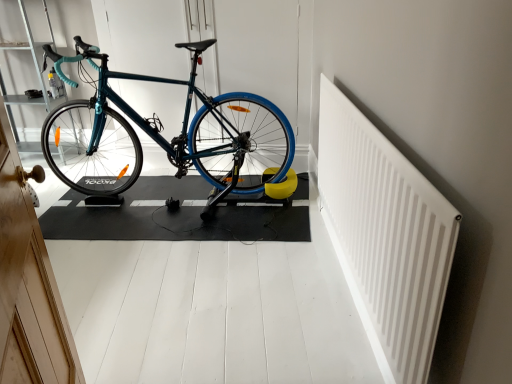
Question: Is teal matte bicycle handlebar at upper left directly adjacent to white plastic radiator at upper right?

Choices:
 (A) yes
 (B) no

Answer: (B)

Question: Can you confirm if teal matte bicycle handlebar at upper left is smaller than white plastic radiator at upper right?

Choices:
 (A) yes
 (B) no

Answer: (B)

Question: From a real-world perspective, is teal matte bicycle handlebar at upper left physically above white plastic radiator at upper right?

Choices:
 (A) yes
 (B) no

Answer: (A)

Question: From the image's perspective, is teal matte bicycle handlebar at upper left beneath white plastic radiator at upper right?

Choices:
 (A) no
 (B) yes

Answer: (A)

Question: Can we say teal matte bicycle handlebar at upper left lies outside white plastic radiator at upper right?

Choices:
 (A) no
 (B) yes

Answer: (B)

Question: Considering the relative positions of teal matte bicycle handlebar at upper left and white plastic radiator at upper right in the image provided, is teal matte bicycle handlebar at upper left to the left of white plastic radiator at upper right from the viewer's perspective?

Choices:
 (A) yes
 (B) no

Answer: (A)

Question: Is white plastic radiator at upper right directly adjacent to teal glossy bicycle at center?

Choices:
 (A) yes
 (B) no

Answer: (B)

Question: Is white plastic radiator at upper right located outside teal glossy bicycle at center?

Choices:
 (A) yes
 (B) no

Answer: (A)

Question: Considering the relative sizes of white plastic radiator at upper right and teal glossy bicycle at center in the image provided, is white plastic radiator at upper right shorter than teal glossy bicycle at center?

Choices:
 (A) yes
 (B) no

Answer: (A)

Question: From the image's perspective, does white plastic radiator at upper right appear higher than teal glossy bicycle at center?

Choices:
 (A) yes
 (B) no

Answer: (B)

Question: Considering the relative sizes of white plastic radiator at upper right and teal glossy bicycle at center in the image provided, is white plastic radiator at upper right smaller than teal glossy bicycle at center?

Choices:
 (A) no
 (B) yes

Answer: (B)

Question: Is white plastic radiator at upper right further to the viewer compared to teal glossy bicycle at center?

Choices:
 (A) no
 (B) yes

Answer: (A)

Question: Does teal glossy bicycle at center touch white plastic radiator at upper right?

Choices:
 (A) no
 (B) yes

Answer: (A)